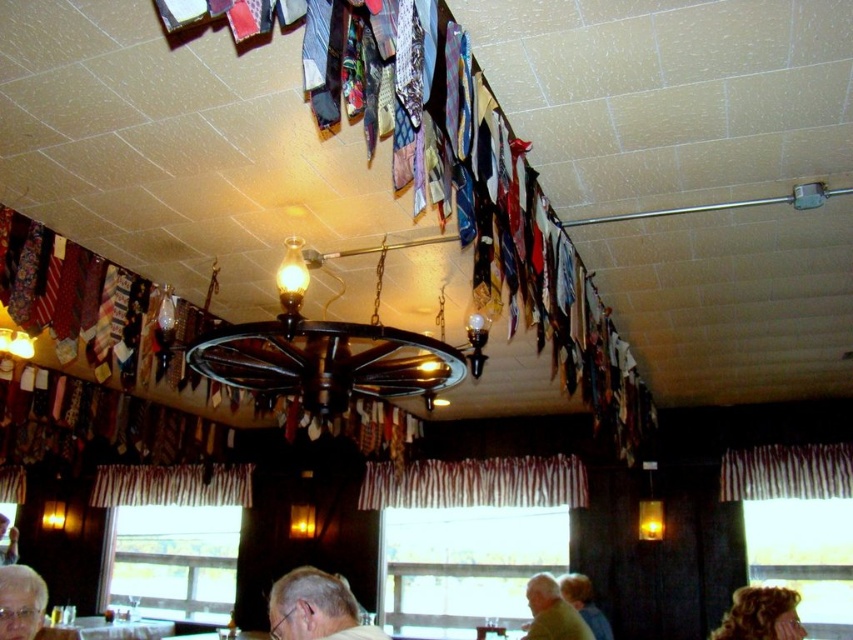
Is gray hair at lower left further to camera compared to light brown hair at lower right?

No, gray hair at lower left is in front of light brown hair at lower right.

Is gray hair at lower left closer to the viewer compared to light brown hair at lower right?

Yes, it is in front of light brown hair at lower right.

Which is in front, point (12, 595) or point (595, 608)?

Point (12, 595) is in front.

At what (x,y) coordinates should I click in order to perform the action: click on gray hair at lower left. Please return your answer as a coordinate pair (x, y). The width and height of the screenshot is (853, 640). Looking at the image, I should click on (25, 605).

Is curly blonde hair at upper center to the right of green fabric shirt at lower right from the viewer's perspective?

Yes, curly blonde hair at upper center is to the right of green fabric shirt at lower right.

You are a GUI agent. You are given a task and a screenshot of the screen. Output one action in this format:
    pyautogui.click(x=<x>, y=<y>)
    Task: Click on the curly blonde hair at upper center
    This screenshot has height=640, width=853.
    Given the screenshot: What is the action you would take?
    pyautogui.click(x=761, y=614)

Between point (734, 636) and point (556, 624), which one is positioned in front?

Positioned in front is point (734, 636).

This screenshot has height=640, width=853. I want to click on curly blonde hair at upper center, so click(x=761, y=614).

Between white glossy table at lower center and light brown hair at lower right, which one has more height?

Standing taller between the two is white glossy table at lower center.

Is point (74, 632) positioned behind point (593, 620)?

Yes, point (74, 632) is farther from viewer.

I want to click on white glossy table at lower center, so click(x=107, y=628).